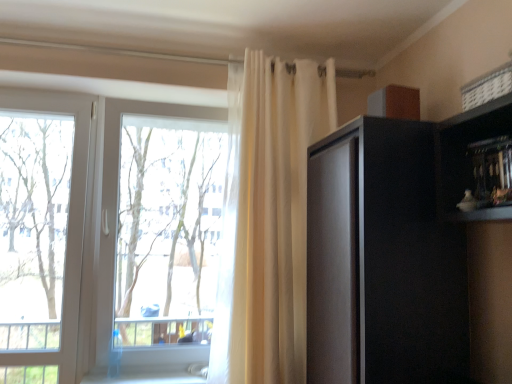
Question: From the image's perspective, would you say matte black cabinet at right is shown under sheer white curtain at upper center?

Choices:
 (A) no
 (B) yes

Answer: (B)

Question: Considering the relative sizes of matte black cabinet at right and sheer white curtain at upper center in the image provided, is matte black cabinet at right bigger than sheer white curtain at upper center?

Choices:
 (A) yes
 (B) no

Answer: (B)

Question: Is matte black cabinet at right oriented away from sheer white curtain at upper center?

Choices:
 (A) yes
 (B) no

Answer: (B)

Question: Is sheer white curtain at upper center surrounded by matte black cabinet at right?

Choices:
 (A) no
 (B) yes

Answer: (A)

Question: Are matte black cabinet at right and sheer white curtain at upper center located far from each other?

Choices:
 (A) no
 (B) yes

Answer: (A)

Question: Is matte black cabinet at right taller than sheer white curtain at upper center?

Choices:
 (A) no
 (B) yes

Answer: (A)

Question: Is transparent glass tree at left facing towards matte black cabinet at right?

Choices:
 (A) no
 (B) yes

Answer: (A)

Question: Is transparent glass tree at left placed right next to matte black cabinet at right?

Choices:
 (A) yes
 (B) no

Answer: (B)

Question: Can you confirm if transparent glass tree at left is positioned to the right of matte black cabinet at right?

Choices:
 (A) yes
 (B) no

Answer: (B)

Question: Considering the relative sizes of transparent glass tree at left and matte black cabinet at right in the image provided, is transparent glass tree at left shorter than matte black cabinet at right?

Choices:
 (A) no
 (B) yes

Answer: (A)

Question: From the image's perspective, is transparent glass tree at left located above matte black cabinet at right?

Choices:
 (A) yes
 (B) no

Answer: (A)

Question: Is transparent glass tree at left positioned with its back to matte black cabinet at right?

Choices:
 (A) no
 (B) yes

Answer: (A)

Question: Is sheer white curtain at upper center to the right of transparent glass window at center from the viewer's perspective?

Choices:
 (A) no
 (B) yes

Answer: (B)